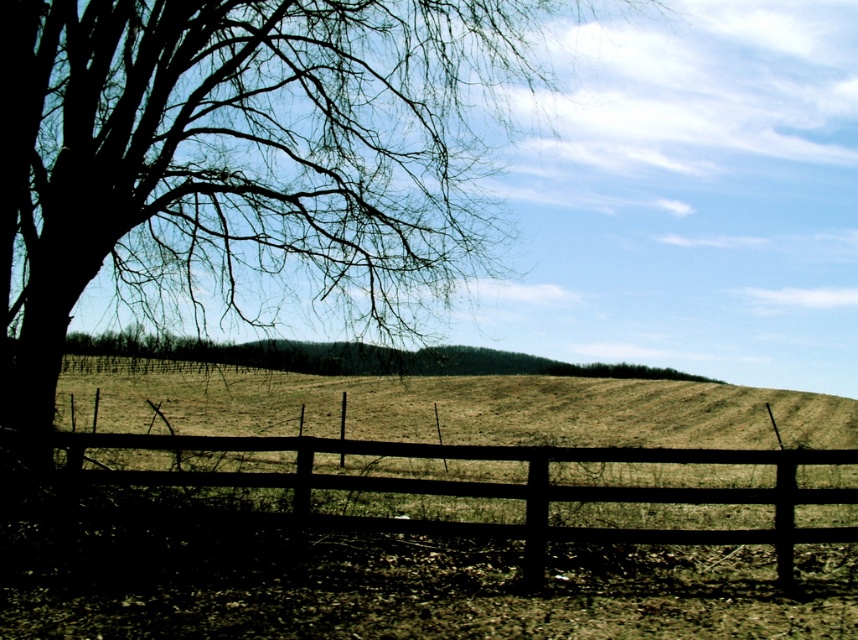
You are a painter setting up an easel to capture this rural landscape. You want to ensure the silhouette bark tree at left and the brown textured tree at center are both visible in your painting. Given their sizes, which tree should you place closer to the center of your canvas to maintain visual balance?

The silhouette bark tree at left is larger than the brown textured tree at center, so to maintain visual balance, you should place the smaller brown textured tree at center closer to the center of the canvas while positioning the larger silhouette bark tree at left slightly off to the side.

Consider the image. You are an artist planning to paint this rural scene. You want to ensure the silhouette bark tree at left and the brown wooden fence at center are proportionally accurate. Which object should you draw first to maintain proper scale, and why?

You should draw the silhouette bark tree at left first because it is larger in size than the brown wooden fence at center, so starting with the larger object ensures the smaller one can be scaled appropriately in relation to it.